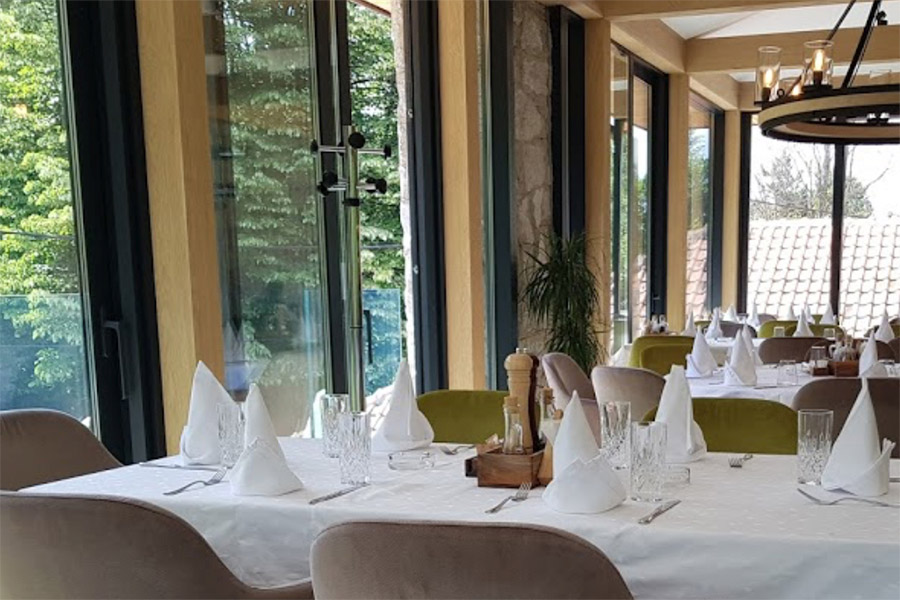
Where is `chandelier glass cups`? chandelier glass cups is located at coordinates (766, 58), (821, 49), (789, 84), (880, 75).